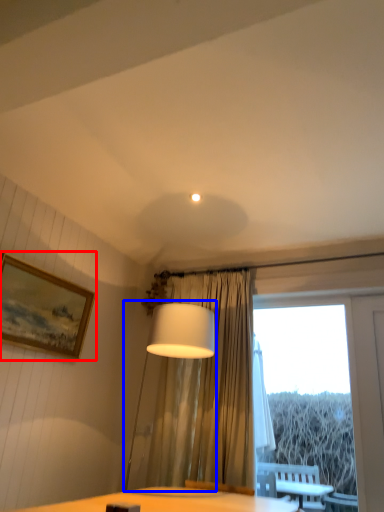
Question: Among these objects, which one is farthest to the camera, picture frame (highlighted by a red box) or table lamp (highlighted by a blue box)?

Choices:
 (A) picture frame
 (B) table lamp

Answer: (A)